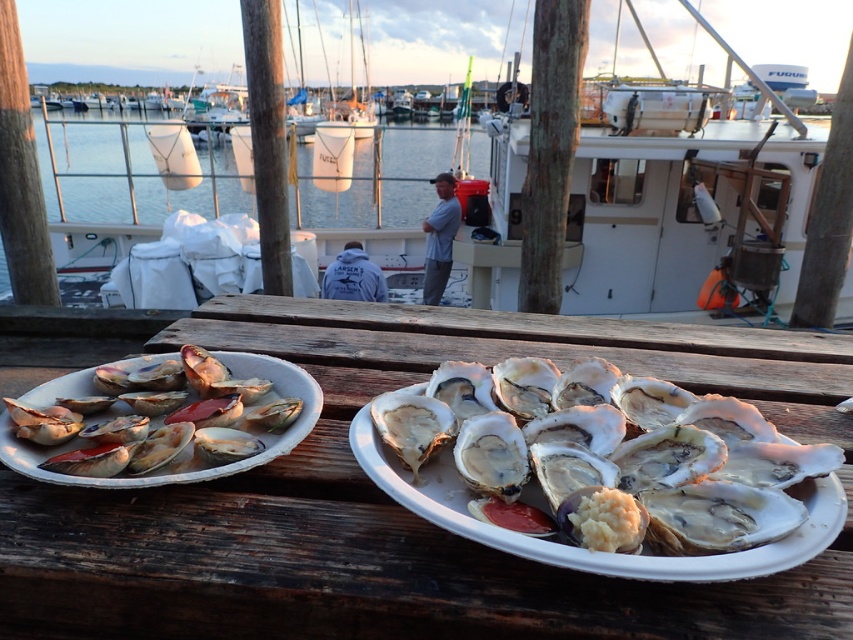
Between point (6, 385) and point (155, 58), which one is positioned behind?

The point (155, 58) is behind.

Does wooden table at center appear over white matte boat at center?

No, wooden table at center is not above white matte boat at center.

Where is `wooden table at center`? wooden table at center is located at coordinates (381, 492).

Is shiny white oyster at center below shiny red shell at left?

Yes, shiny white oyster at center is below shiny red shell at left.

Does point (567, 496) lie in front of point (108, 467)?

Yes.

This screenshot has width=853, height=640. Find the location of `shiny white oyster at center`. shiny white oyster at center is located at coordinates (596, 456).

Does point (323, 74) lie in front of point (207, 397)?

No, it is behind (207, 397).

Does white matte boat at center appear over shiny red shell at left?

Indeed, white matte boat at center is positioned over shiny red shell at left.

Identify the location of white matte boat at center. (129, 38).

The image size is (853, 640). In order to click on white matte boat at center in this screenshot , I will do `click(129, 38)`.